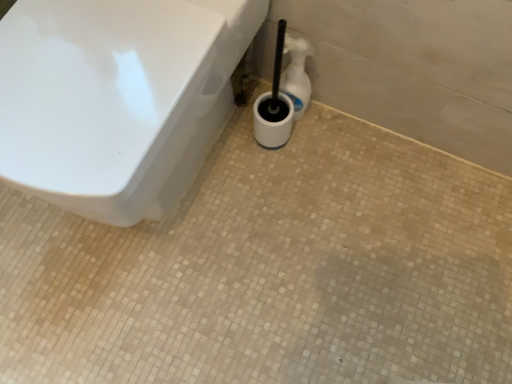
Question: Would you say white plastic bottle at center is outside white glossy toilet at upper left?

Choices:
 (A) yes
 (B) no

Answer: (A)

Question: Is white plastic bottle at center positioned before white glossy toilet at upper left?

Choices:
 (A) yes
 (B) no

Answer: (B)

Question: From a real-world perspective, is white plastic bottle at center physically above white glossy toilet at upper left?

Choices:
 (A) no
 (B) yes

Answer: (A)

Question: Can you confirm if white plastic bottle at center is positioned to the right of white glossy toilet at upper left?

Choices:
 (A) yes
 (B) no

Answer: (A)

Question: Does white plastic bottle at center have a smaller size compared to white glossy toilet at upper left?

Choices:
 (A) yes
 (B) no

Answer: (A)

Question: Is white plastic bottle at center oriented away from white glossy toilet at upper left?

Choices:
 (A) no
 (B) yes

Answer: (A)

Question: Could white plastic bottle at center be considered to be inside white glossy toilet at upper left?

Choices:
 (A) no
 (B) yes

Answer: (A)

Question: Considering the relative sizes of white glossy toilet at upper left and white plastic bottle at center in the image provided, is white glossy toilet at upper left bigger than white plastic bottle at center?

Choices:
 (A) no
 (B) yes

Answer: (B)

Question: Can you confirm if white glossy toilet at upper left is taller than white plastic bottle at center?

Choices:
 (A) no
 (B) yes

Answer: (B)

Question: Is the position of white glossy toilet at upper left less distant than that of white plastic bottle at center?

Choices:
 (A) yes
 (B) no

Answer: (A)

Question: From a real-world perspective, is white glossy toilet at upper left positioned over white plastic bottle at center based on gravity?

Choices:
 (A) yes
 (B) no

Answer: (A)

Question: From a real-world perspective, is white glossy toilet at upper left positioned under white plastic bottle at center based on gravity?

Choices:
 (A) no
 (B) yes

Answer: (A)

Question: Is white plastic bottle at center bigger or smaller than white glossy toilet at upper left?

Choices:
 (A) small
 (B) big

Answer: (A)